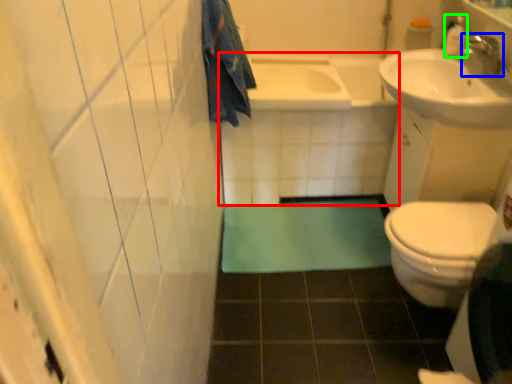
Question: Which object is positioned closest to bath (highlighted by a red box)? Select from tap (highlighted by a blue box) and toiletry (highlighted by a green box).

Choices:
 (A) tap
 (B) toiletry

Answer: (B)